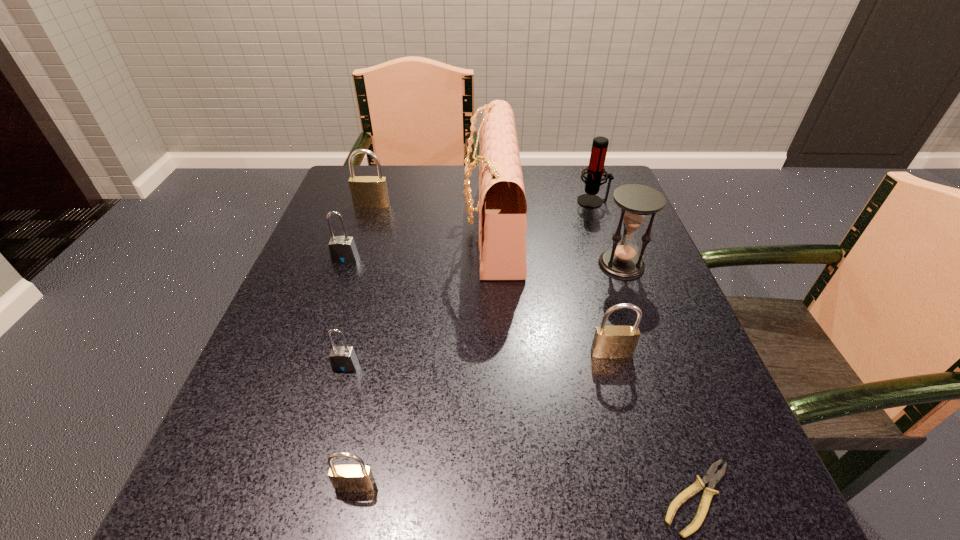
The image size is (960, 540). Identify the location of vacant space situated 0.080m on the back of the hourglass. (609, 229).

Find the location of `free space located on the front-facing side of the leftmost brass padlock`. free space located on the front-facing side of the leftmost brass padlock is located at coordinates [338, 307].

Where is `free space located 0.200m on the shackle of the farther gray padlock`? free space located 0.200m on the shackle of the farther gray padlock is located at coordinates (318, 336).

This screenshot has width=960, height=540. In order to click on vacant region located 0.240m on the front-facing side of the fourth nearest object in this screenshot , I will do `click(654, 508)`.

The image size is (960, 540). I want to click on free spot located on the shackle of the smaller gray padlock, so click(x=323, y=447).

This screenshot has width=960, height=540. Identify the location of vacant space located on the back of the pliers. (618, 273).

Locate an element on the screen. handbag located in the far edge section of the desktop is located at coordinates click(502, 207).

Where is `microphone that is positioned at the far edge`? microphone that is positioned at the far edge is located at coordinates (595, 170).

Find the location of a particular element. The image size is (960, 540). padlock that is at the far edge is located at coordinates (367, 191).

The height and width of the screenshot is (540, 960). I want to click on padlock located in the near edge section of the desktop, so click(346, 478).